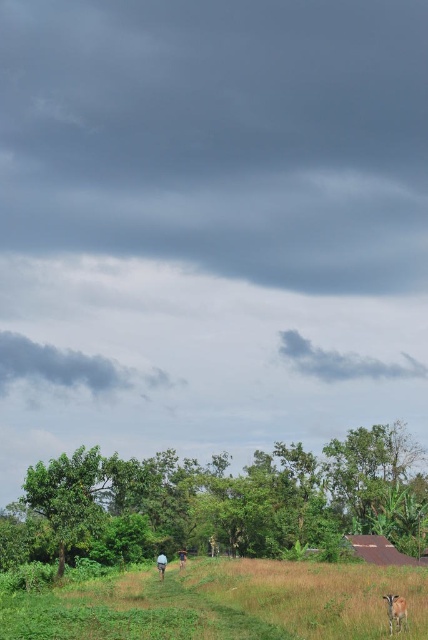
You are standing in the rural landscape scene. There is a green grassy pasture at lower center marked by point (223, 604). If you want to reach the green grassy pasture at lower center, which direction should you move relative to your current position?

To reach the green grassy pasture at lower center marked by point (223, 604), you should move downward since the pasture is located at the lower portion of the scene.

You are standing in the rural landscape scene and want to take a photo of the blue fabric person at lower center. Since the green grassy pasture at lower center is in front of them, will you need to adjust your position to see the person clearly?

The green grassy pasture at lower center is much taller than the blue fabric person at lower center, so you will need to move closer or find a higher vantage point to see the person clearly over the tall grass.

You are standing in the open field and see the brown fur goat at lower right and the blue fabric person at lower center. Which of the two is narrower in width?

The brown fur goat at lower right is thinner than the blue fabric person at lower center, so the brown fur goat at lower right is narrower in width.